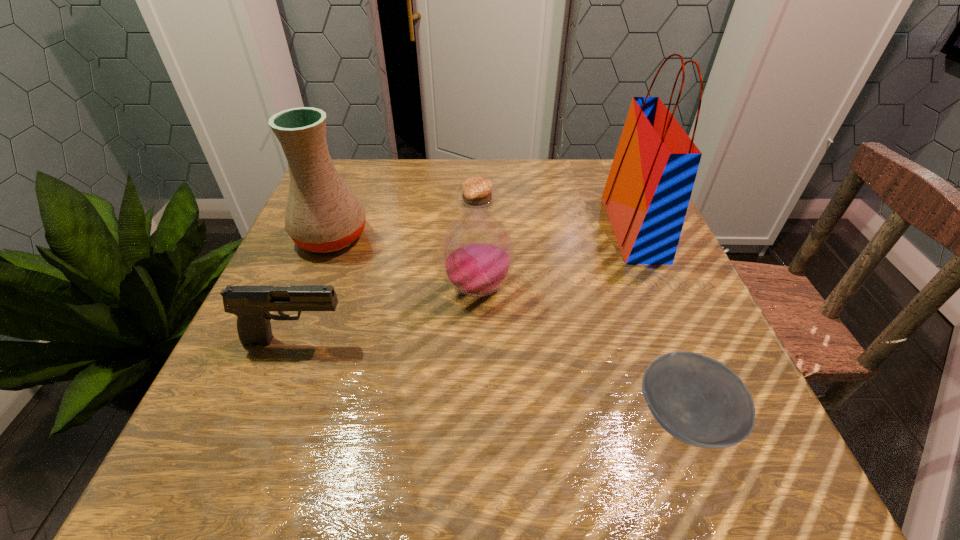
The image size is (960, 540). What are the coordinates of `vacant space located 0.050m on the handle side of the tallest object` in the screenshot? It's located at (588, 228).

Where is `vacant space situated 0.220m on the right of the pottery`? Image resolution: width=960 pixels, height=540 pixels. vacant space situated 0.220m on the right of the pottery is located at coordinates (468, 237).

You are a GUI agent. You are given a task and a screenshot of the screen. Output one action in this format:
    pyautogui.click(x=<x>, y=<y>)
    Task: Click on the vacant space located 0.320m on the right of the third nearest object
    
    Given the screenshot: What is the action you would take?
    pyautogui.click(x=678, y=289)

Where is `vacant space located aim along the barrel of the pistol`? The image size is (960, 540). vacant space located aim along the barrel of the pistol is located at coordinates (475, 340).

In order to click on free space located on the left of the bowl in this screenshot , I will do `click(451, 418)`.

The image size is (960, 540). In order to click on object that is at the far edge in this screenshot , I will do `click(647, 193)`.

Where is `object located at the near edge`? object located at the near edge is located at coordinates (698, 400).

Find the location of `pottery at the left edge`. pottery at the left edge is located at coordinates (322, 214).

Locate an element on the screen. The width and height of the screenshot is (960, 540). pistol positioned at the left edge is located at coordinates pyautogui.click(x=251, y=304).

The height and width of the screenshot is (540, 960). What are the coordinates of `shopping bag located in the right edge section of the desktop` in the screenshot? It's located at (647, 193).